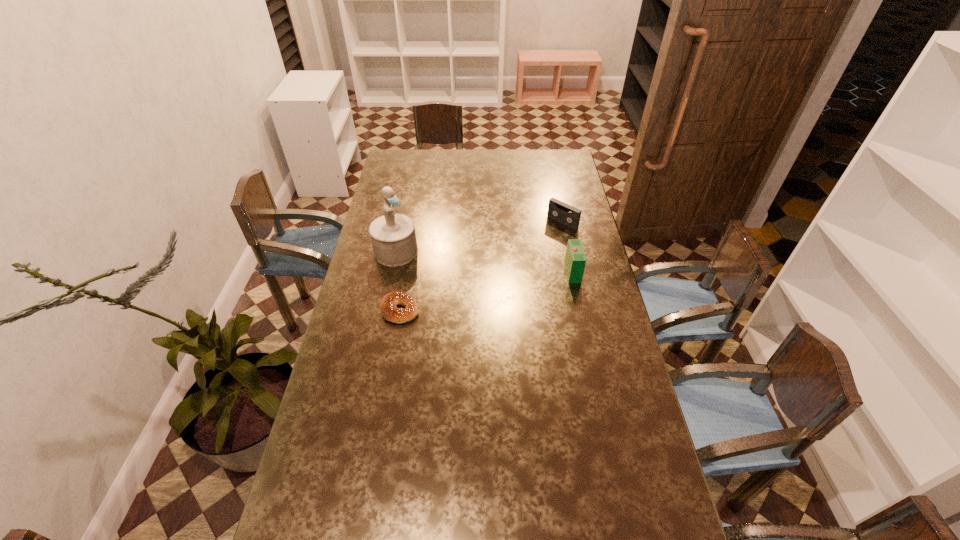
Locate an element on the screen. The width and height of the screenshot is (960, 540). free space on the desktop that is between the nearest object and the third shortest object and is positioned at the beak of the tallest object is located at coordinates (467, 295).

Locate an element on the screen. The height and width of the screenshot is (540, 960). free spot on the desktop that is between the shortest object and the alarm clock and is positioned on the front-facing side of the second shortest object is located at coordinates (481, 292).